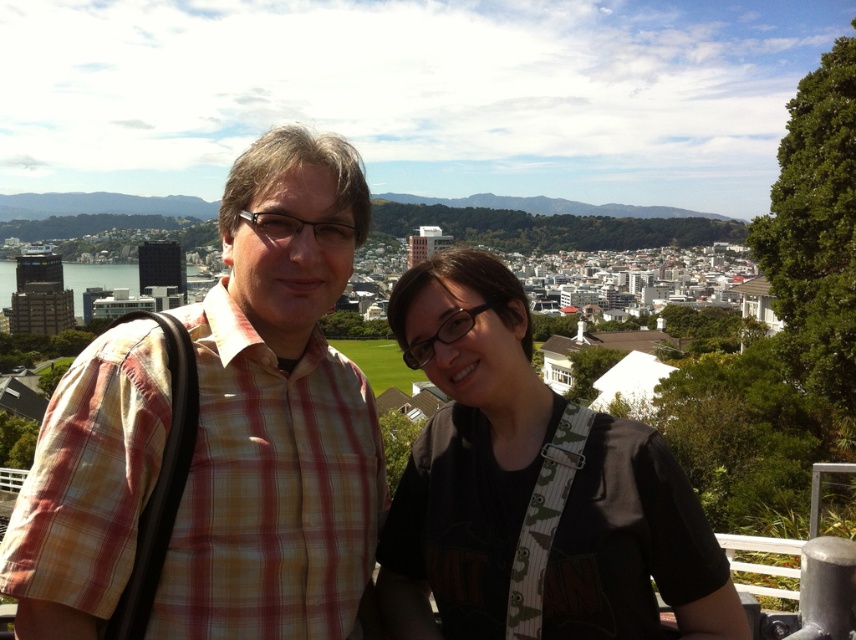
Where is `plaid shirt at center`? plaid shirt at center is located at coordinates (278, 413).

In the scene shown: Can you confirm if plaid shirt at center is positioned to the left of black matte shirt at center?

Indeed, plaid shirt at center is positioned on the left side of black matte shirt at center.

Locate an element on the screen. The width and height of the screenshot is (856, 640). plaid shirt at center is located at coordinates (278, 413).